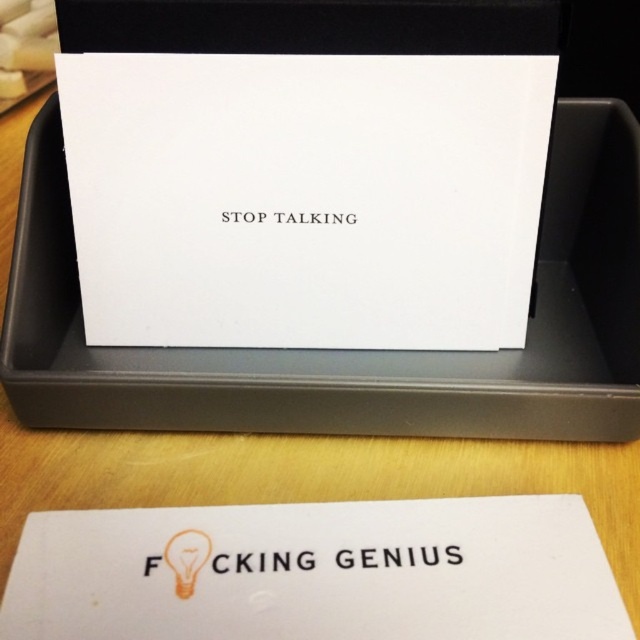
You are organizing a desk and need to place a 30 cm wide folder between the white paper at center and the white matte card at center. Can you fit the folder between them without overlapping either object?

The white paper at center and white matte card at center are 27.22 centimeters apart. Since the folder is 30 cm wide, it cannot fit between them as the space is narrower than the folder.

You are organizing a desk and want to place both the white paper at center and the white matte card at center so that they are visible from above. Can you arrange them in a way that allows both items to be seen without one completely blocking the other?

The white paper at center is above the white matte card at center, so arranging them as described would mean the white paper at center is already positioned over the white matte card at center. To ensure both are visible, you could slightly shift one so that only part of each is visible, but based on the current description, the white paper at center is blocking the white matte card at center completely unless adjusted.